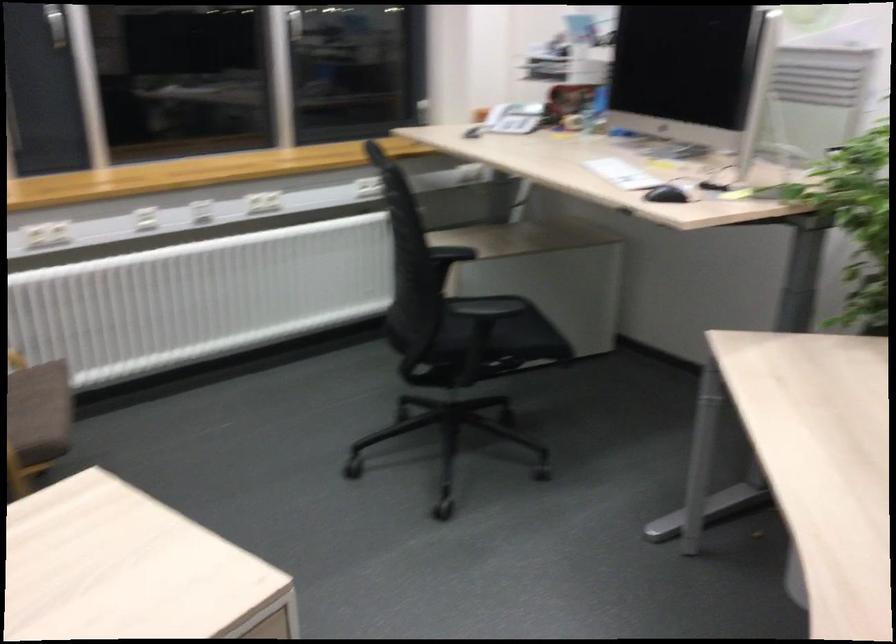
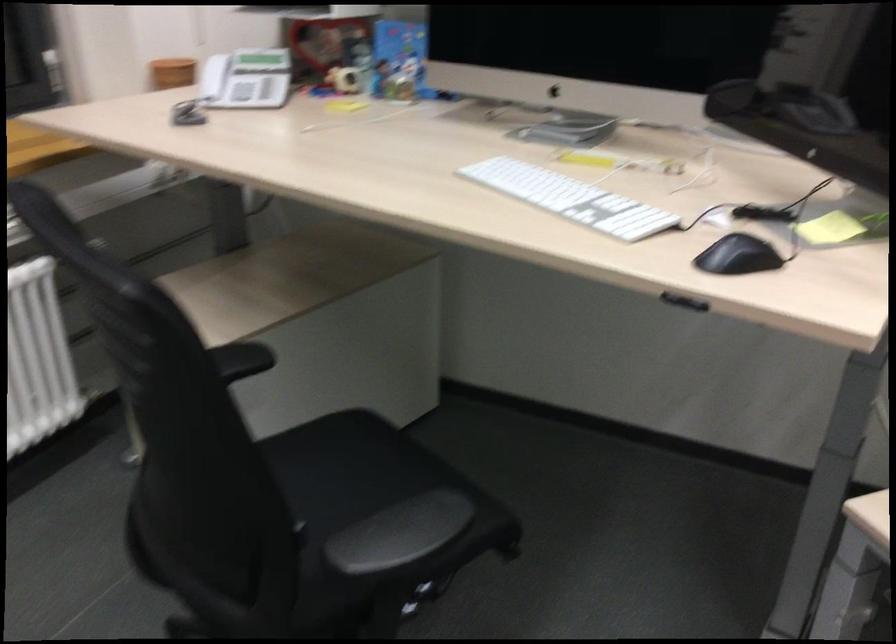
Find the pixel in the second image that matches (x=668, y=192) in the first image.

(737, 256)